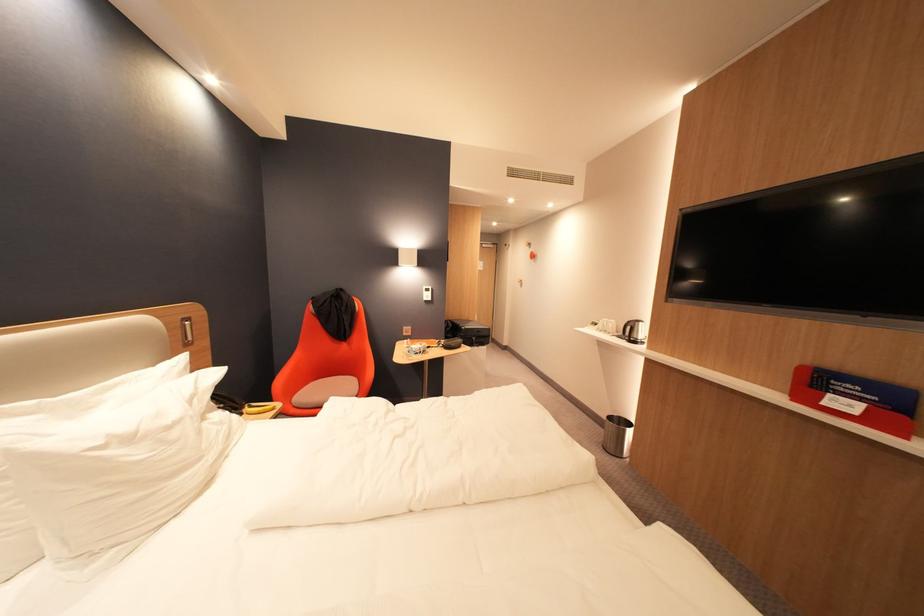
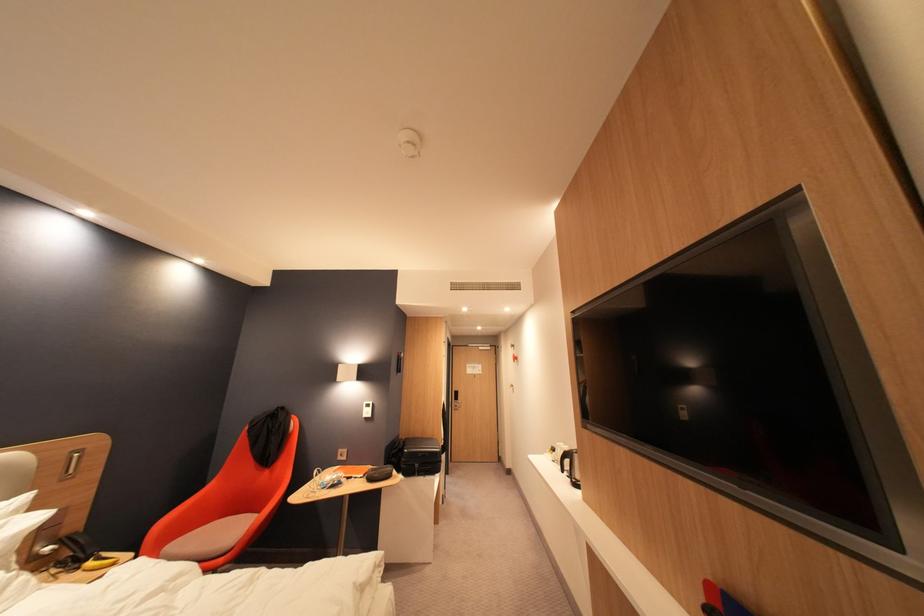
Find the pixel in the second image that matches (483,339) in the first image.

(427, 467)